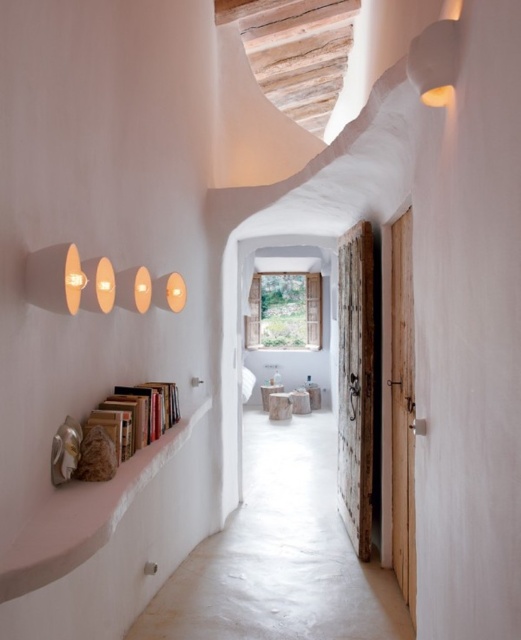
You are designing a new display for the corridor and need to place a 1.2 meter wide decorative panel. The panel must be placed on either the white stucco ledge at lower left or the wooden bookshelf at left. Based on their widths, which surface can accommodate the panel without overhanging?

The white stucco ledge at lower left has a larger width than the wooden bookshelf at left, so the 1.2 meter wide decorative panel can be placed on the white stucco ledge at lower left without overhanging.

You are standing in the corridor and want to place a small potted plant on a surface. Which object between the white stucco ledge at lower left and the wooden bookshelf at left is more suitable for placing the plant?

The white stucco ledge at lower left is located below the wooden bookshelf at left, so it is more accessible and level for placing the plant.

You are a painter holding a 6.5 inch wide canvas. You want to place it between the white stucco ledge at lower left and the wooden bookshelf at left. Will it fit without overlapping either?

The distance between the white stucco ledge at lower left and the wooden bookshelf at left is 6.34 inches. Since the canvas is 6.5 inches wide, it will not fit without overlapping either object.